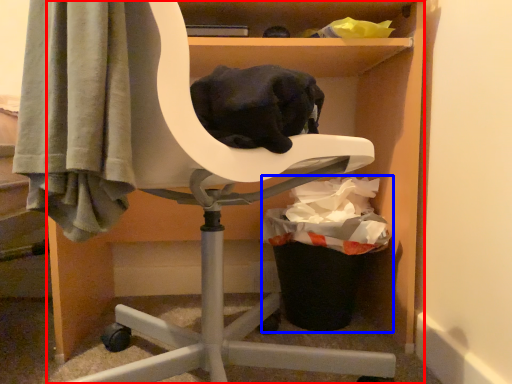
Question: Which object appears farthest to the camera in this image, furniture (highlighted by a red box) or garbage (highlighted by a blue box)?

Choices:
 (A) furniture
 (B) garbage

Answer: (B)